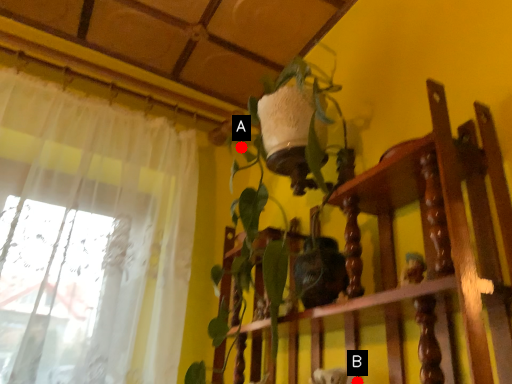
Question: Two points are circled on the image, labeled by A and B beside each circle. Which point is closer to the camera?

Choices:
 (A) A is closer
 (B) B is closer

Answer: (B)